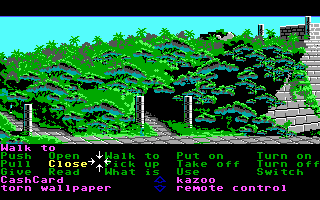
What are the coordinates of `columns` in the screenshot? It's located at (28, 112), (139, 104), (187, 110).